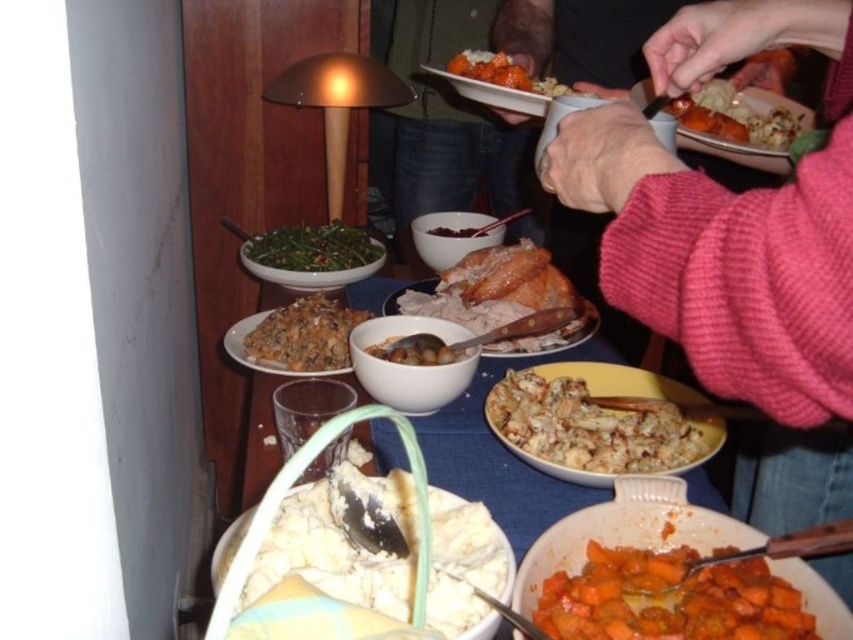
Question: Which point is farther to the camera?

Choices:
 (A) (819, 189)
 (B) (508, 280)
 (C) (604, 604)
 (D) (450, 234)

Answer: (D)

Question: Can you confirm if brown crumbly at center is positioned to the left of dark brown glossy gravy at center?

Choices:
 (A) no
 (B) yes

Answer: (B)

Question: Among these objects, which one is nearest to the camera?

Choices:
 (A) golden brown roasted sweet potato at upper right
 (B) dark brown glossy gravy at center
 (C) matte white bowl at center

Answer: (A)

Question: Does white creamy stuffing at center appear on the right side of carrot glazed at upper center?

Choices:
 (A) yes
 (B) no

Answer: (A)

Question: Based on their relative distances, which object is farther from the brown crumbly at center?

Choices:
 (A) carrot glazed at upper center
 (B) dark brown glossy gravy at center
 (C) golden brown roasted sweet potato at upper right

Answer: (C)

Question: Does pink wool sweater at upper right appear over golden brown roasted turkey at center?

Choices:
 (A) yes
 (B) no

Answer: (A)